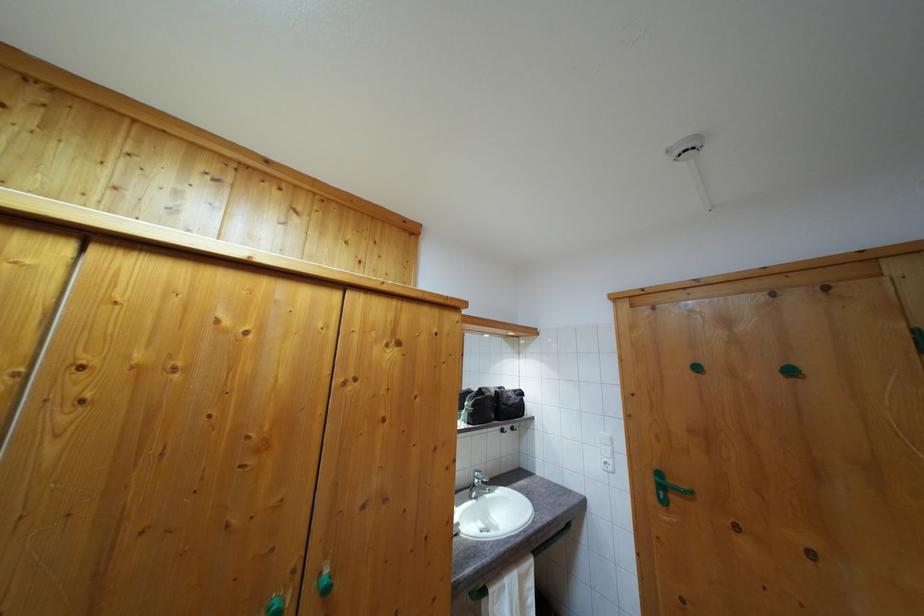
Which object does [492,405] point to?

It refers to a black travel bag.